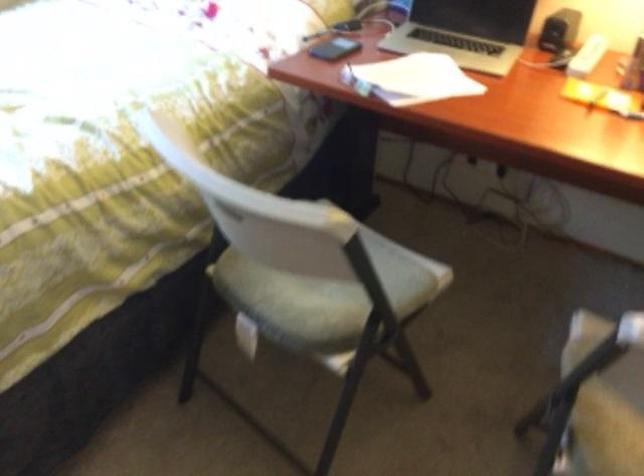
Where would you lift the black smartphone? Please return your answer as a coordinate pair (x, y).

(334, 48)